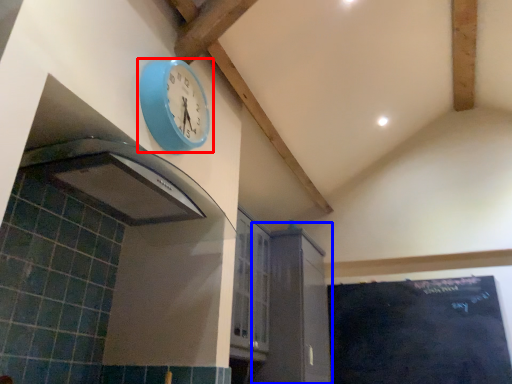
Question: Among these objects, which one is farthest to the camera, wall clock (highlighted by a red box) or cabinetry (highlighted by a blue box)?

Choices:
 (A) wall clock
 (B) cabinetry

Answer: (B)